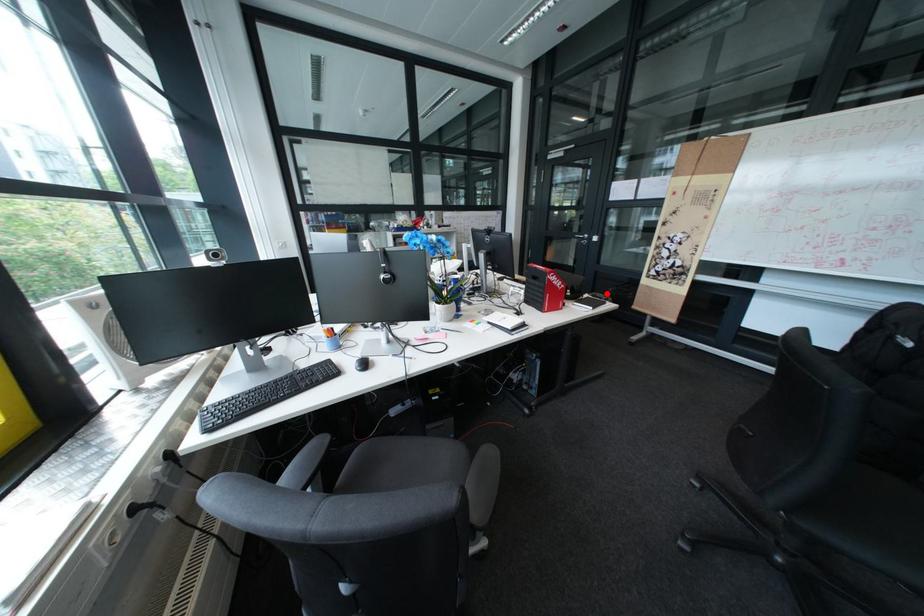
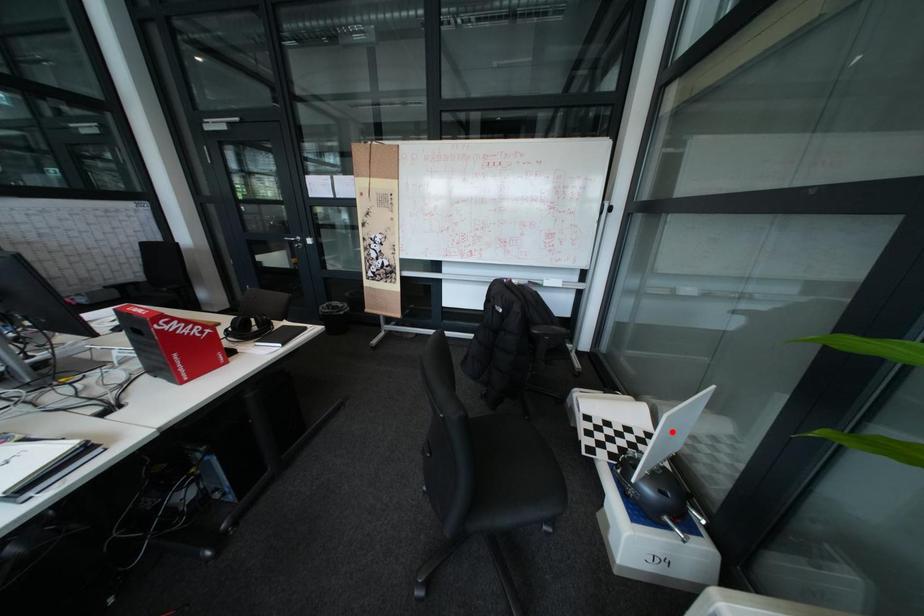
I am providing you with two images of the same scene from different viewpoints. A red point is marked on the first image and another point is marked on the second image. Is the red point in image1 aligned with the point shown in image2?

No